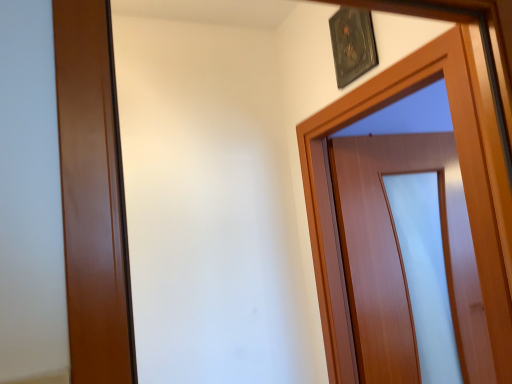
The height and width of the screenshot is (384, 512). What do you see at coordinates (352, 44) in the screenshot?
I see `metallic plaque at upper center` at bounding box center [352, 44].

Where is `metallic plaque at upper center`? This screenshot has height=384, width=512. metallic plaque at upper center is located at coordinates (352, 44).

Describe the element at coordinates (463, 186) in the screenshot. The width and height of the screenshot is (512, 384). I see `wooden door at upper right` at that location.

Locate an element on the screen. wooden door at upper right is located at coordinates (463, 186).

What are the coordinates of `metallic plaque at upper center` in the screenshot? It's located at (352, 44).

Looking at this image, can you confirm if wooden door at upper right is positioned to the left of metallic plaque at upper center?

No.

Is the position of wooden door at upper right less distant than that of metallic plaque at upper center?

Yes, wooden door at upper right is closer to the camera.

Is point (478, 77) less distant than point (356, 35)?

Yes, point (478, 77) is closer to viewer.

From the image's perspective, is wooden door at upper right above metallic plaque at upper center?

Actually, wooden door at upper right appears below metallic plaque at upper center in the image.

From a real-world perspective, does wooden door at upper right stand above metallic plaque at upper center?

No, from a real-world perspective, wooden door at upper right is not above metallic plaque at upper center.

From the picture: Which of these two, wooden door at upper right or metallic plaque at upper center, is thinner?

metallic plaque at upper center.

Between wooden door at upper right and metallic plaque at upper center, which one has less height?

metallic plaque at upper center.

Between wooden door at upper right and metallic plaque at upper center, which one has smaller size?

metallic plaque at upper center.

Based on the photo, is wooden door at upper right completely or partially outside of metallic plaque at upper center?

Yes, wooden door at upper right is not within metallic plaque at upper center.

Are wooden door at upper right and metallic plaque at upper center located far from each other?

No.

Is wooden door at upper right positioned with its back to metallic plaque at upper center?

No, metallic plaque at upper center is not at the back of wooden door at upper right.

Where is `picture frame behind the wooden door at upper right`? picture frame behind the wooden door at upper right is located at coordinates (352, 44).

Between metallic plaque at upper center and wooden door at upper right, which one appears on the right side from the viewer's perspective?

wooden door at upper right.

Considering the positions of objects metallic plaque at upper center and wooden door at upper right in the image provided, who is behind, metallic plaque at upper center or wooden door at upper right?

metallic plaque at upper center is further from the camera.

Considering the positions of points (346, 48) and (495, 147), is point (346, 48) closer to camera compared to point (495, 147)?

No, (346, 48) is behind (495, 147).

From the image's perspective, which object appears higher, metallic plaque at upper center or wooden door at upper right?

From the image's view, metallic plaque at upper center is above.

From a real-world perspective, between metallic plaque at upper center and wooden door at upper right, who is vertically lower?

wooden door at upper right, from a real-world perspective.

Looking at this image, can you confirm if metallic plaque at upper center is wider than wooden door at upper right?

No, metallic plaque at upper center is not wider than wooden door at upper right.

Who is taller, metallic plaque at upper center or wooden door at upper right?

wooden door at upper right.

Which of these two, metallic plaque at upper center or wooden door at upper right, is bigger?

wooden door at upper right.

Looking at this image, is metallic plaque at upper center spatially inside wooden door at upper right, or outside of it?

metallic plaque at upper center is not inside wooden door at upper right, it's outside.

Are metallic plaque at upper center and wooden door at upper right making contact?

A: No, metallic plaque at upper center is not touching wooden door at upper right.

Is metallic plaque at upper center turned away from wooden door at upper right?

No.

Measure the distance between metallic plaque at upper center and wooden door at upper right.

14.63 inches.

The image size is (512, 384). What are the coordinates of `picture frame positioned vertically above the wooden door at upper right (from a real-world perspective)` in the screenshot? It's located at (352, 44).

You are a GUI agent. You are given a task and a screenshot of the screen. Output one action in this format:
    pyautogui.click(x=<x>, y=<y>)
    Task: Click on the door that appears below the metallic plaque at upper center (from a real-world perspective)
    Image resolution: width=512 pixels, height=384 pixels.
    Given the screenshot: What is the action you would take?
    pyautogui.click(x=463, y=186)

The image size is (512, 384). I want to click on picture frame above the wooden door at upper right (from a real-world perspective), so pyautogui.click(x=352, y=44).